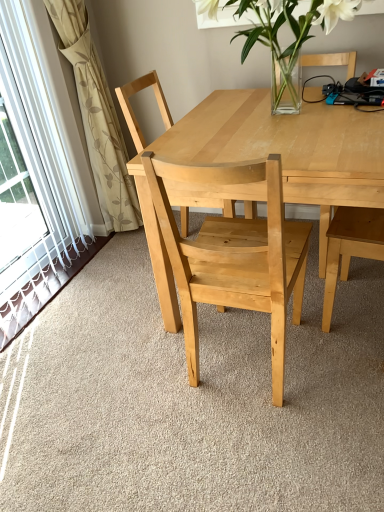
Identify the location of vacant area that lies between natural wood chair at center, the 1th chair viewed from the front, and natural wood table at center. (305, 386).